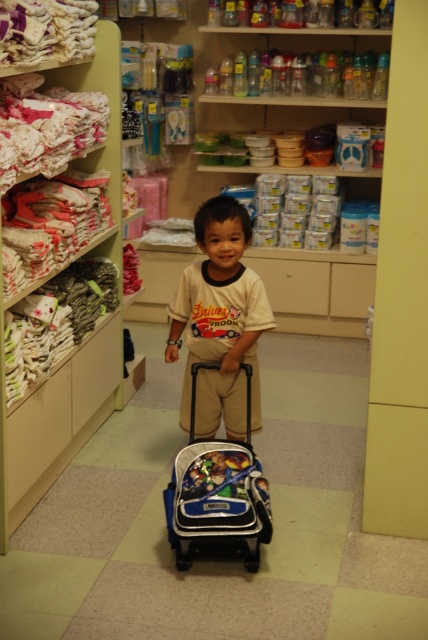
Question: Is beige cotton shirt at center in front of blue fabric backpack at center?

Choices:
 (A) yes
 (B) no

Answer: (B)

Question: Does beige cotton shirt at center have a smaller size compared to blue fabric backpack at center?

Choices:
 (A) yes
 (B) no

Answer: (B)

Question: Among these points, which one is farthest from the camera?

Choices:
 (A) (184, 557)
 (B) (228, 269)

Answer: (B)

Question: Among these objects, which one is nearest to the camera?

Choices:
 (A) blue fabric backpack at center
 (B) beige cotton shirt at center

Answer: (A)

Question: Is beige cotton shirt at center bigger than blue fabric backpack at center?

Choices:
 (A) yes
 (B) no

Answer: (A)